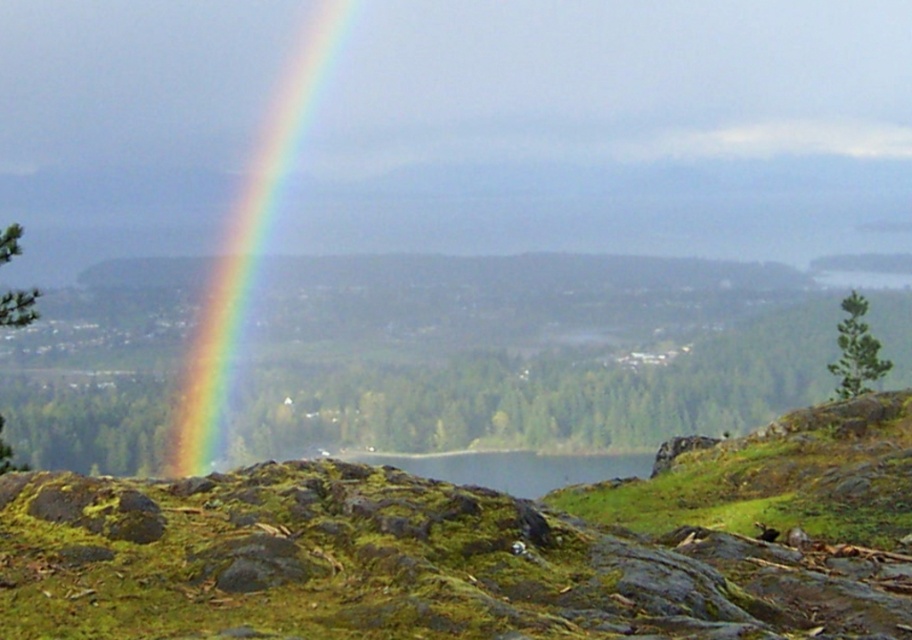
Question: Which point is farther from the camera taking this photo?

Choices:
 (A) (308, 72)
 (B) (415, 456)

Answer: (A)

Question: Among these points, which one is nearest to the camera?

Choices:
 (A) (241, 300)
 (B) (568, 464)

Answer: (B)

Question: Which point is farther from the camera taking this photo?

Choices:
 (A) (314, 70)
 (B) (467, 468)

Answer: (A)

Question: Does rainbow at left have a smaller size compared to green mossy rock at center?

Choices:
 (A) yes
 (B) no

Answer: (A)

Question: Is rainbow at left closer to camera compared to green mossy rock at center?

Choices:
 (A) no
 (B) yes

Answer: (A)

Question: Can you confirm if rainbow at left is positioned to the left of green mossy rock at center?

Choices:
 (A) yes
 (B) no

Answer: (A)